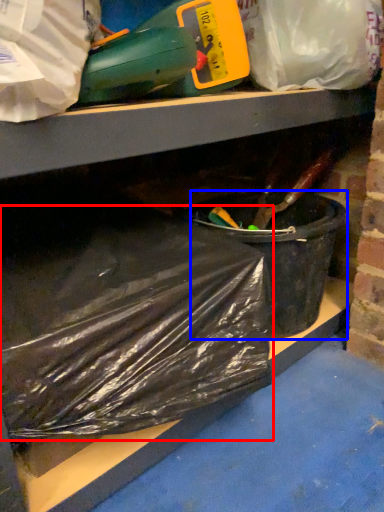
Question: Which object is closer to the camera taking this photo, plastic bag (highlighted by a red box) or recycling bin (highlighted by a blue box)?

Choices:
 (A) plastic bag
 (B) recycling bin

Answer: (A)